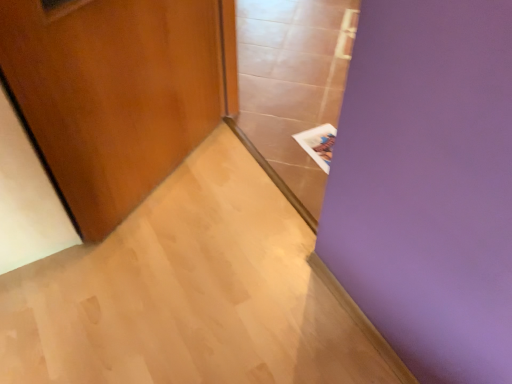
Question: Considering the positions of white paper at upper right and transparent glass door at center in the image, is white paper at upper right taller or shorter than transparent glass door at center?

Choices:
 (A) tall
 (B) short

Answer: (B)

Question: Based on their positions, is white paper at upper right located to the left or right of transparent glass door at center?

Choices:
 (A) left
 (B) right

Answer: (B)

Question: Which object is the farthest from the white paper at upper right?

Choices:
 (A) transparent glass door at center
 (B) wooden door at left

Answer: (B)

Question: Based on their relative distances, which object is nearer to the white paper at upper right?

Choices:
 (A) wooden door at left
 (B) transparent glass door at center

Answer: (B)